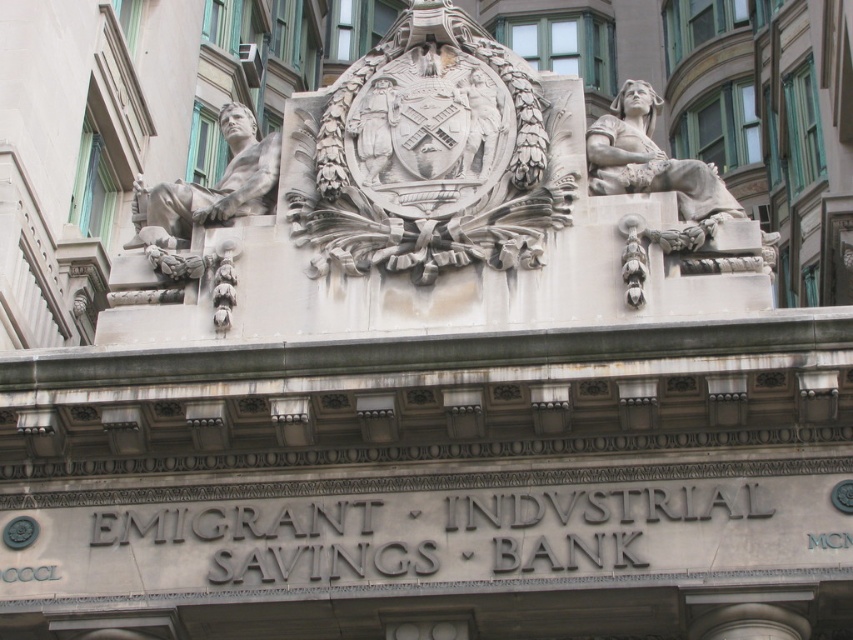
Between point (161, 205) and point (689, 177), which one is positioned behind?

Point (161, 205)

Between matte gray stone statue at left and white stone statue at upper right, which one has less height?

With less height is matte gray stone statue at left.

The height and width of the screenshot is (640, 853). In order to click on matte gray stone statue at left in this screenshot , I will do `click(212, 186)`.

Identify the location of matte gray stone statue at left. (212, 186).